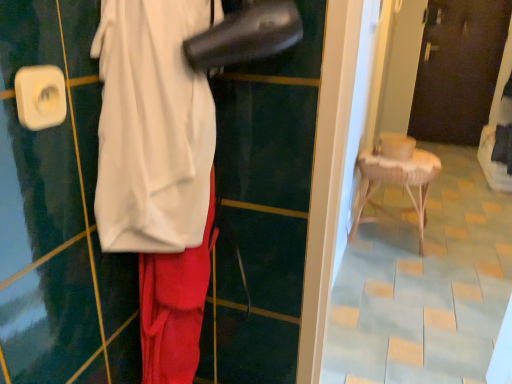
Question: Can you confirm if white fabric at center is thinner than dark brown wooden door at upper center?

Choices:
 (A) yes
 (B) no

Answer: (B)

Question: Considering the relative sizes of white fabric at center and dark brown wooden door at upper center in the image provided, is white fabric at center bigger than dark brown wooden door at upper center?

Choices:
 (A) no
 (B) yes

Answer: (A)

Question: Does white fabric at center appear on the right side of dark brown wooden door at upper center?

Choices:
 (A) yes
 (B) no

Answer: (B)

Question: From a real-world perspective, is white fabric at center on dark brown wooden door at upper center?

Choices:
 (A) yes
 (B) no

Answer: (A)

Question: Considering the relative positions of white fabric at center and dark brown wooden door at upper center in the image provided, is white fabric at center behind dark brown wooden door at upper center?

Choices:
 (A) yes
 (B) no

Answer: (B)

Question: Would you say dark brown wooden door at upper center is part of white fabric at center's contents?

Choices:
 (A) yes
 (B) no

Answer: (B)

Question: Is woven wood stool at right at the back of dark brown wooden door at upper center?

Choices:
 (A) no
 (B) yes

Answer: (A)

Question: Are dark brown wooden door at upper center and woven wood stool at right making contact?

Choices:
 (A) yes
 (B) no

Answer: (B)

Question: Could you tell me if dark brown wooden door at upper center is facing woven wood stool at right?

Choices:
 (A) no
 (B) yes

Answer: (B)

Question: From a real-world perspective, is dark brown wooden door at upper center physically below woven wood stool at right?

Choices:
 (A) yes
 (B) no

Answer: (B)

Question: Considering the relative sizes of dark brown wooden door at upper center and woven wood stool at right in the image provided, is dark brown wooden door at upper center shorter than woven wood stool at right?

Choices:
 (A) no
 (B) yes

Answer: (A)

Question: Considering the relative sizes of dark brown wooden door at upper center and woven wood stool at right in the image provided, is dark brown wooden door at upper center smaller than woven wood stool at right?

Choices:
 (A) yes
 (B) no

Answer: (A)

Question: Is dark brown wooden door at upper center completely or partially outside of white fabric at center?

Choices:
 (A) yes
 (B) no

Answer: (A)